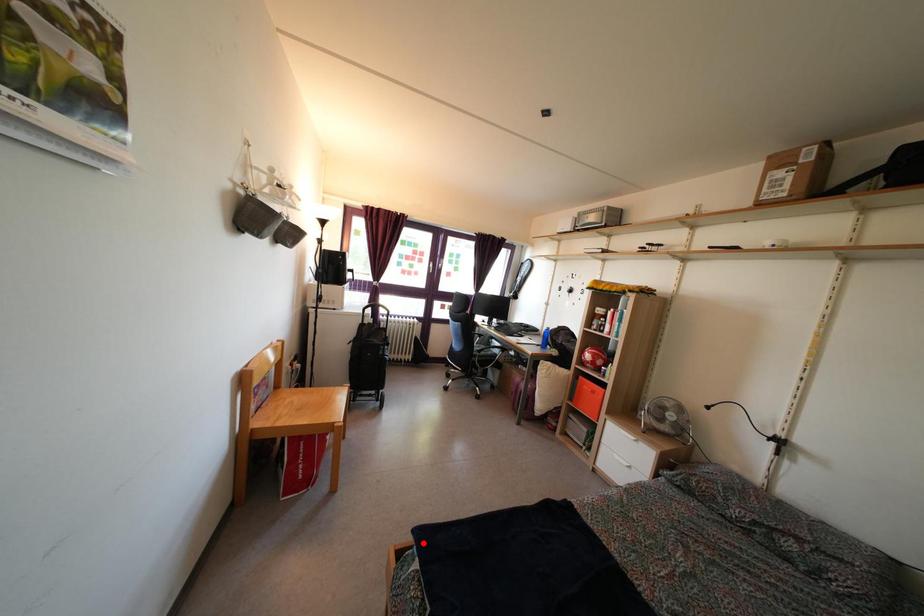
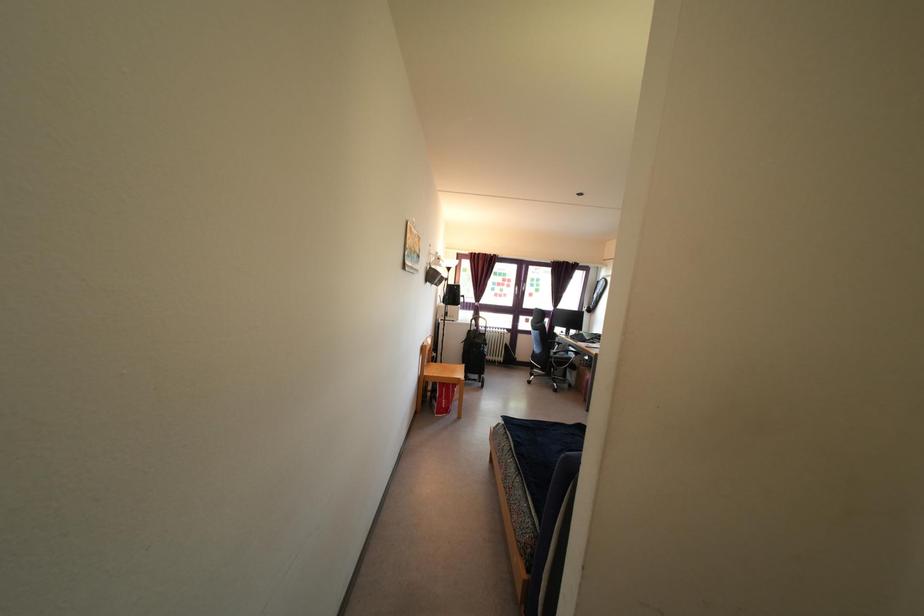
Question: I am providing you with two images of the same scene from different viewpoints. A red point is shown in image1. For the corresponding object point in image2, is it positioned nearer or farther from the camera?

Choices:
 (A) Nearer
 (B) Farther

Answer: (A)